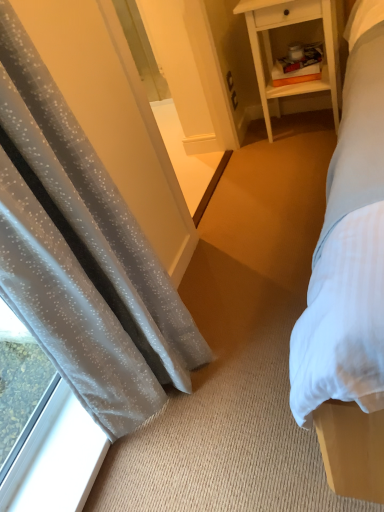
You are a GUI agent. You are given a task and a screenshot of the screen. Output one action in this format:
    pyautogui.click(x=<x>, y=<y>)
    Task: Click on the vacant region under white wood nightstand at upper right (from a real-world perspective)
    The width and height of the screenshot is (384, 512).
    Given the screenshot: What is the action you would take?
    pyautogui.click(x=304, y=127)